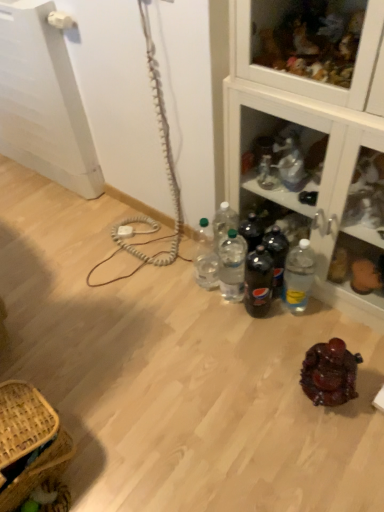
I want to click on vacant space in between dark glass bottle at center, the 3th bottle positioned from the right, and shiny brown candy at center, so click(x=284, y=345).